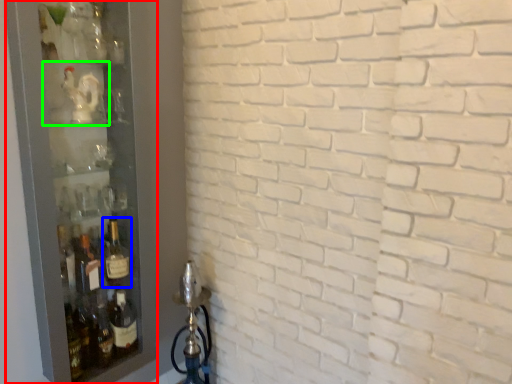
Question: Based on their relative distances, which object is farther from glass door (highlighted by a red box)? Choose from bottle (highlighted by a blue box) and shelf (highlighted by a green box).

Choices:
 (A) bottle
 (B) shelf

Answer: (A)